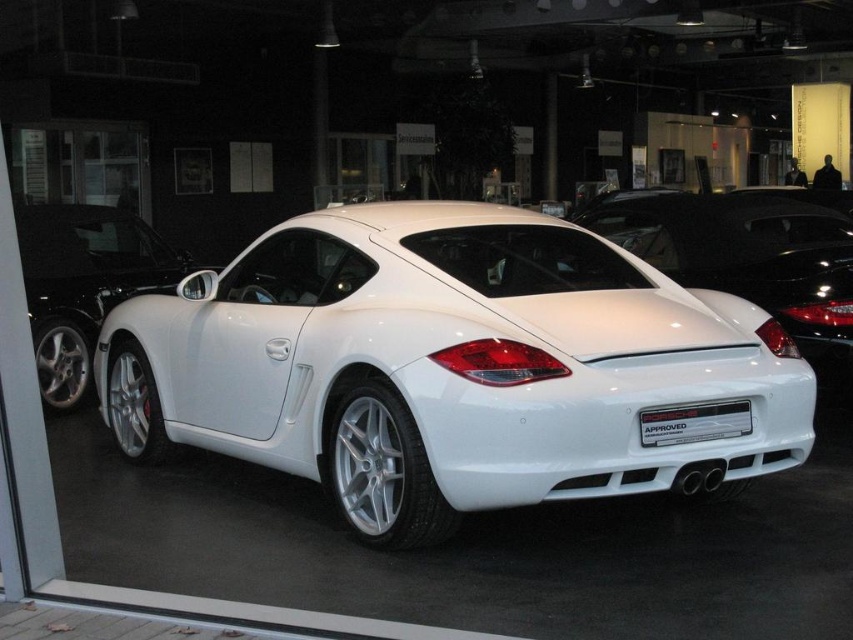
Question: Is white metallic sports car at center to the right of white glossy car at center from the viewer's perspective?

Choices:
 (A) no
 (B) yes

Answer: (A)

Question: Among these points, which one is farthest from the camera?

Choices:
 (A) (38, 257)
 (B) (738, 256)

Answer: (A)

Question: Can you confirm if white metallic sports car at center is smaller than white metallic sedan at center?

Choices:
 (A) yes
 (B) no

Answer: (B)

Question: Among these points, which one is farthest from the camera?

Choices:
 (A) (71, 253)
 (B) (822, 253)

Answer: (A)

Question: Which of the following is the farthest from the observer?

Choices:
 (A) (341, 476)
 (B) (35, 364)
 (C) (767, 282)

Answer: (C)

Question: From the image, what is the correct spatial relationship of white metallic sports car at center in relation to white metallic sedan at center?

Choices:
 (A) above
 (B) below

Answer: (B)